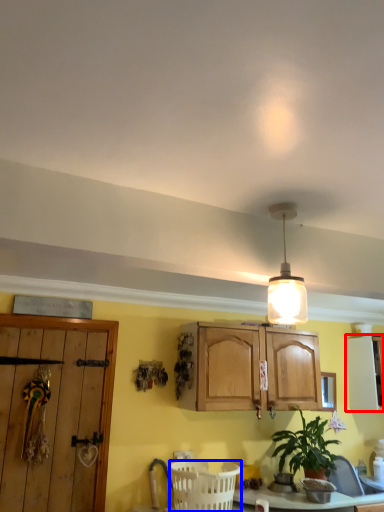
Question: Among these objects, which one is farthest to the camera, cabinetry (highlighted by a red box) or basket (highlighted by a blue box)?

Choices:
 (A) cabinetry
 (B) basket

Answer: (A)